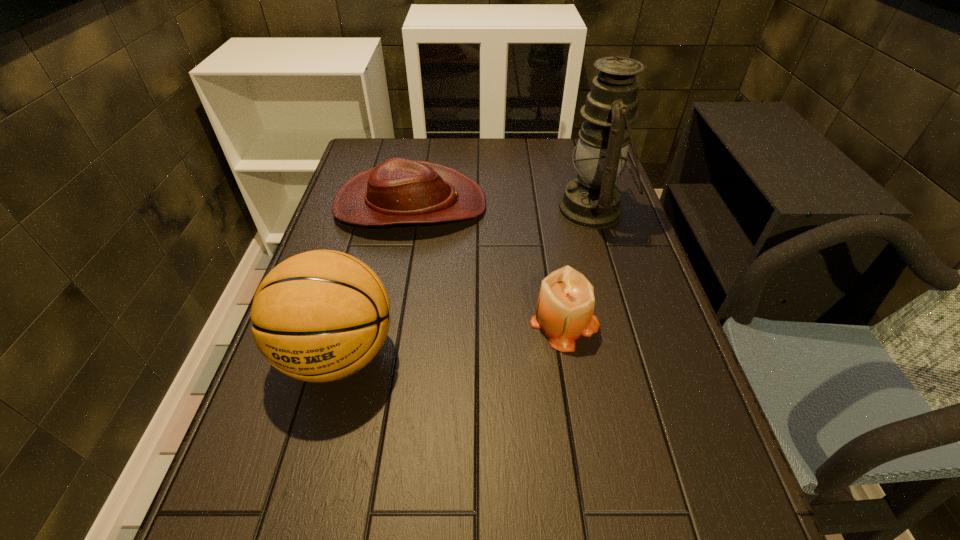
Find the location of a particular element. Image resolution: width=960 pixels, height=540 pixels. vacant area in the image that satisfies the following two spatial constraints: 1. on the front-facing side of the shortest object; 2. on the surface of the basketball near the brand logo is located at coordinates (383, 354).

Identify the location of vacant position in the image that satisfies the following two spatial constraints: 1. on the front-facing side of the shortest object; 2. on the back side of the third tallest object. Image resolution: width=960 pixels, height=540 pixels. (389, 321).

This screenshot has width=960, height=540. Identify the location of vacant area in the image that satisfies the following two spatial constraints: 1. on the front-facing side of the cowboy hat; 2. on the back side of the oil lamp. (410, 210).

The image size is (960, 540). I want to click on vacant space that satisfies the following two spatial constraints: 1. on the front-facing side of the cowboy hat; 2. on the surface of the basketball near the brand logo, so coord(383,354).

Where is `vacant space that satisfies the following two spatial constraints: 1. on the front-facing side of the shortest object; 2. on the back side of the tallest object`? vacant space that satisfies the following two spatial constraints: 1. on the front-facing side of the shortest object; 2. on the back side of the tallest object is located at coordinates click(410, 210).

At what (x,y) coordinates should I click in order to perform the action: click on vacant space that satisfies the following two spatial constraints: 1. on the front-facing side of the cowboy hat; 2. on the back side of the third tallest object. Please return your answer as a coordinate pair (x, y). The image size is (960, 540). Looking at the image, I should click on (389, 321).